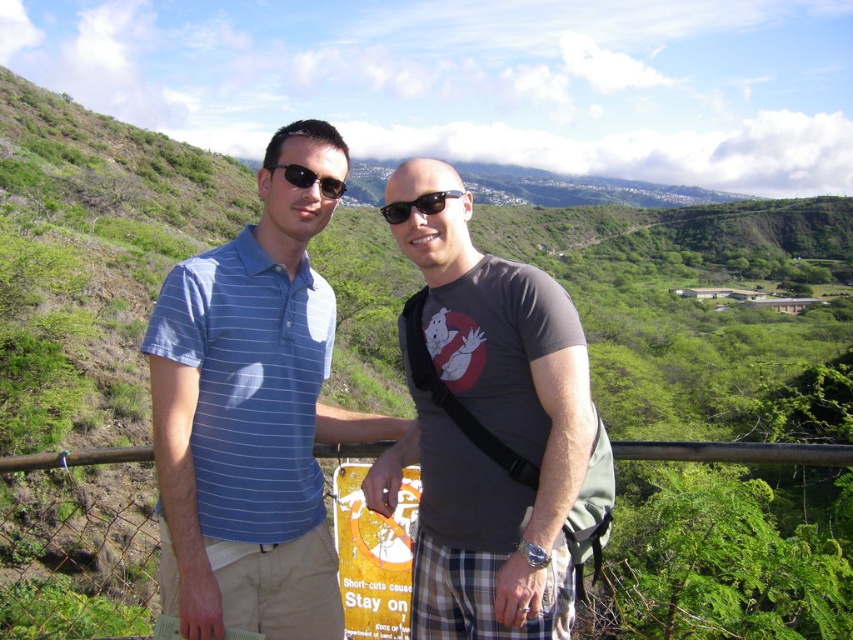
Question: Can you confirm if blue striped polo shirt at center is wider than dark gray t-shirt at center?

Choices:
 (A) no
 (B) yes

Answer: (B)

Question: Can you confirm if blue striped polo shirt at center is wider than matte black sunglasses at center?

Choices:
 (A) no
 (B) yes

Answer: (B)

Question: Which point is farther to the camera?

Choices:
 (A) blue striped polo shirt at center
 (B) matte black sunglasses at center

Answer: (B)

Question: Can you confirm if blue striped polo shirt at center is wider than matte black sunglasses at center?

Choices:
 (A) yes
 (B) no

Answer: (A)

Question: Which point appears closest to the camera in this image?

Choices:
 (A) (314, 180)
 (B) (428, 440)
 (C) (263, 538)

Answer: (C)

Question: Based on their relative distances, which object is nearer to the matte black sunglasses at center?

Choices:
 (A) dark gray t-shirt at center
 (B) blue striped polo shirt at center

Answer: (A)